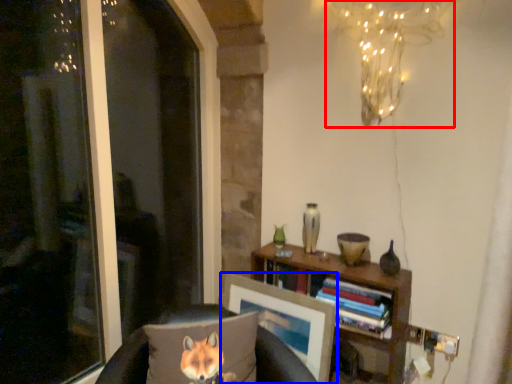
Question: Which object appears farthest to the camera in this image, lamp (highlighted by a red box) or picture frame (highlighted by a blue box)?

Choices:
 (A) lamp
 (B) picture frame

Answer: (B)